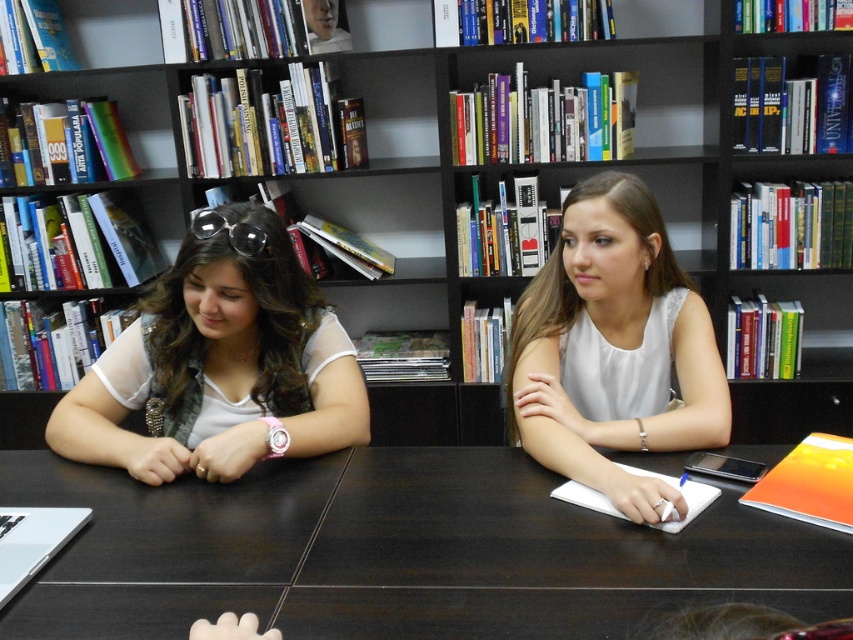
You are a librarian who needs to place a 1.2 meter tall sculpture on the dark wood table at center. Based on the height of the black matte bookcase at upper center, can the sculpture be placed there without exceeding the table height?

The dark wood table at center is not as tall as the black matte bookcase at upper center. Since the sculpture is 1.2 meters tall, it can be placed on the table as long as the table height is sufficient to support it. However, the description only states the table is shorter than the bookcase, so we cannot confirm if the table itself is tall enough for the sculpture without additional information about the table or bookcase dimensions.

Consider the image. You are standing in the library and need to place a new book on the black matte bookcase at upper center. According to the image, where exactly is the black matte bookcase located?

The black matte bookcase at upper center is located at point (531, 157), so you should place the new book there.